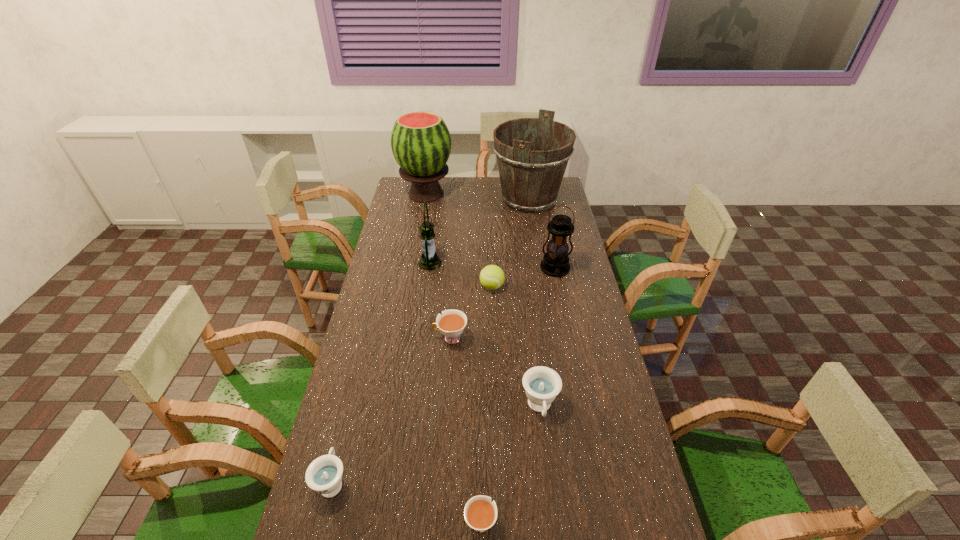
In order to click on bucket in this screenshot , I will do `click(532, 154)`.

The width and height of the screenshot is (960, 540). I want to click on watermelon, so click(421, 144).

The height and width of the screenshot is (540, 960). Find the location of `green lantern`. green lantern is located at coordinates (429, 260).

I want to click on the right lantern, so click(555, 263).

The width and height of the screenshot is (960, 540). Find the location of `the farther blue teacup`. the farther blue teacup is located at coordinates (542, 384).

At what (x,y) coordinates should I click in order to perform the action: click on the right blue teacup. Please return your answer as a coordinate pair (x, y). The image size is (960, 540). Looking at the image, I should click on (542, 384).

I want to click on tennis ball, so click(492, 277).

At what (x,y) coordinates should I click in order to perform the action: click on the left white teacup. Please return your answer as a coordinate pair (x, y). Image resolution: width=960 pixels, height=540 pixels. Looking at the image, I should click on (451, 323).

The height and width of the screenshot is (540, 960). Find the location of `the third teacup from right to left`. the third teacup from right to left is located at coordinates (451, 323).

Where is `the nearer blue teacup`? This screenshot has width=960, height=540. the nearer blue teacup is located at coordinates (324, 475).